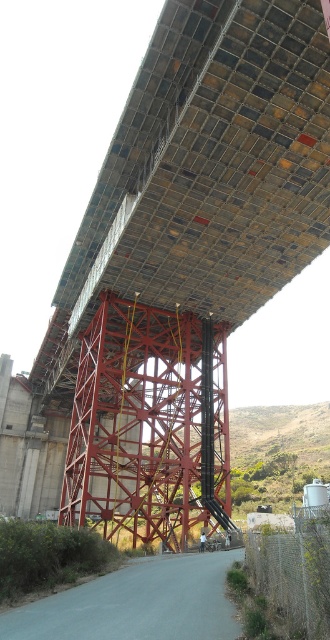
Consider the image. Does metallic grid at upper center have a smaller size compared to metallic red bridge at center?

Incorrect, metallic grid at upper center is not smaller in size than metallic red bridge at center.

Looking at this image, between metallic grid at upper center and metallic red bridge at center, which one is positioned lower?

metallic red bridge at center

What are the coordinates of `metallic grid at upper center` in the screenshot? It's located at (204, 173).

You are a GUI agent. You are given a task and a screenshot of the screen. Output one action in this format:
    pyautogui.click(x=<x>, y=<y>)
    Task: Click on the metallic grid at upper center
    This screenshot has width=330, height=640.
    Given the screenshot: What is the action you would take?
    pyautogui.click(x=204, y=173)